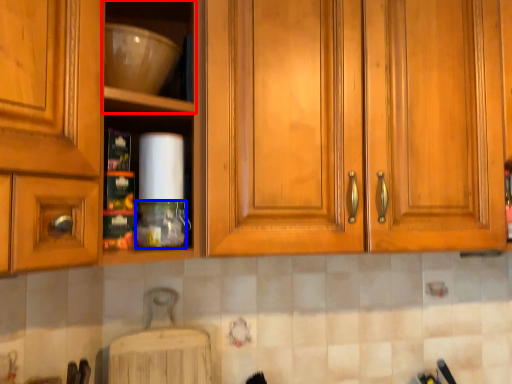
Question: Which object appears farthest to the camera in this image, shelf (highlighted by a red box) or bottle (highlighted by a blue box)?

Choices:
 (A) shelf
 (B) bottle

Answer: (B)